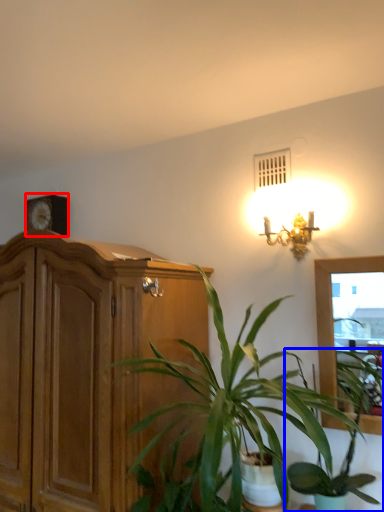
Question: Which point is closer to the camera, clock (highlighted by a red box) or houseplant (highlighted by a blue box)?

Choices:
 (A) clock
 (B) houseplant

Answer: (B)